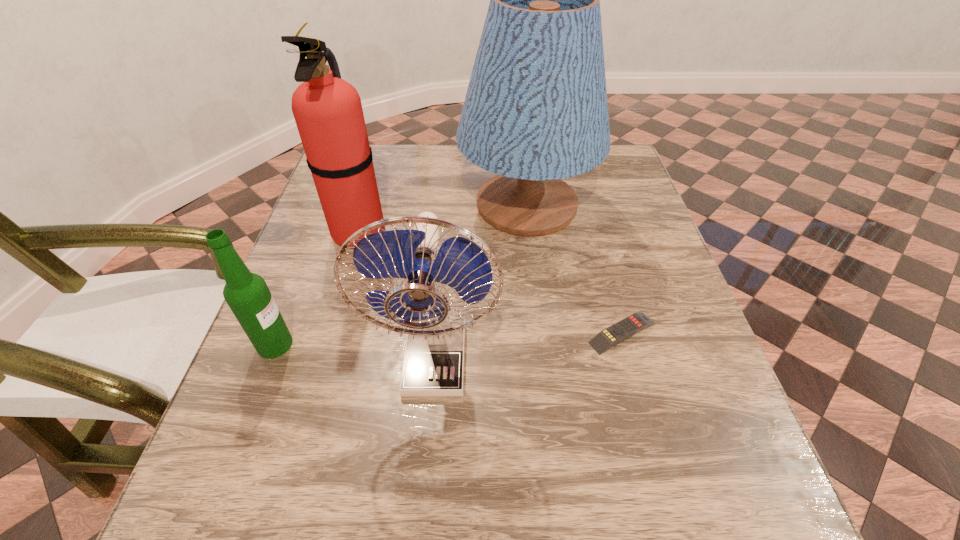
Image resolution: width=960 pixels, height=540 pixels. In order to click on object at the far edge in this screenshot , I will do `click(535, 112)`.

Where is `fire extinguisher that is at the left edge`? The width and height of the screenshot is (960, 540). fire extinguisher that is at the left edge is located at coordinates (328, 112).

Identify the location of beer bottle that is at the left edge. Image resolution: width=960 pixels, height=540 pixels. (247, 294).

Locate an element on the screen. This screenshot has height=540, width=960. lampshade positioned at the right edge is located at coordinates (535, 112).

I want to click on remote control positioned at the right edge, so pos(618,332).

This screenshot has width=960, height=540. What are the coordinates of `object located at the far right corner` in the screenshot? It's located at (535, 112).

Find the location of a particular element. Image resolution: width=960 pixels, height=540 pixels. vacant area at the far edge of the desktop is located at coordinates (437, 149).

At what (x,y) coordinates should I click in order to perform the action: click on vacant space at the left edge. Please return your answer as a coordinate pair (x, y). The image size is (960, 540). Looking at the image, I should click on point(259,372).

Image resolution: width=960 pixels, height=540 pixels. Find the location of `vacant space at the right edge`. vacant space at the right edge is located at coordinates (626, 246).

At what (x,y) coordinates should I click in order to perform the action: click on vacant space at the far left corner of the desktop. Please return your answer as a coordinate pair (x, y). This screenshot has width=960, height=540. Looking at the image, I should click on (378, 144).